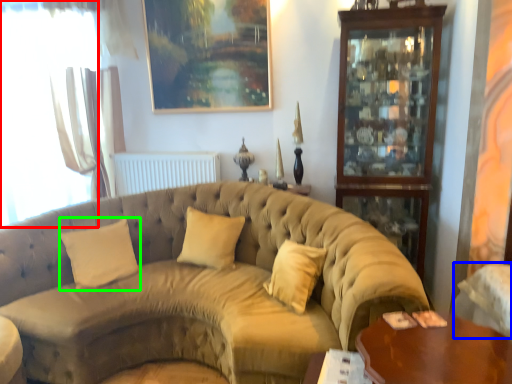
Question: Which object is positioned farthest from window (highlighted by a red box)? Select from armchair (highlighted by a blue box) and pillow (highlighted by a green box).

Choices:
 (A) armchair
 (B) pillow

Answer: (A)